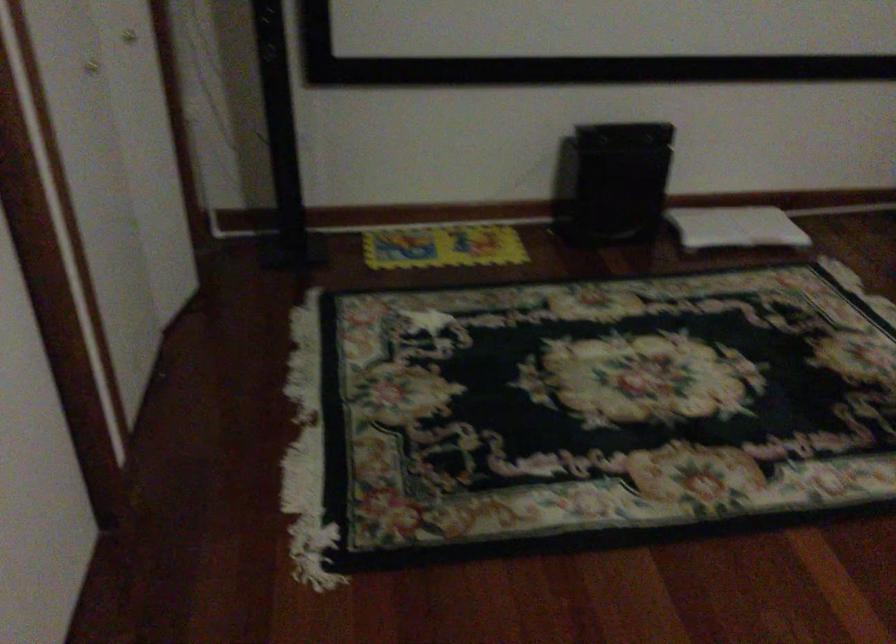
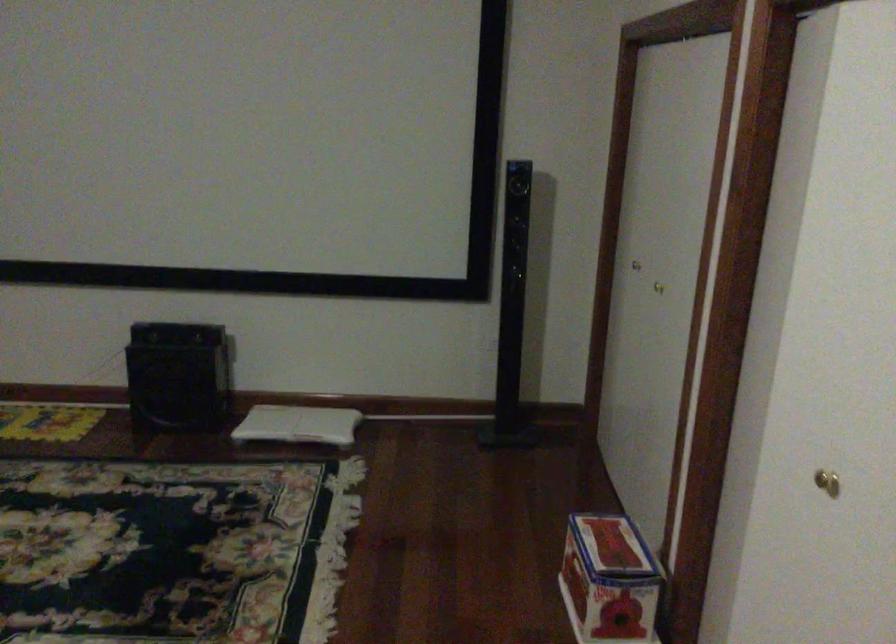
Question: The images are taken continuously from a first-person perspective. In which direction are you moving?

Choices:
 (A) Left
 (B) Right
 (C) Forward
 (D) Backward

Answer: (B)